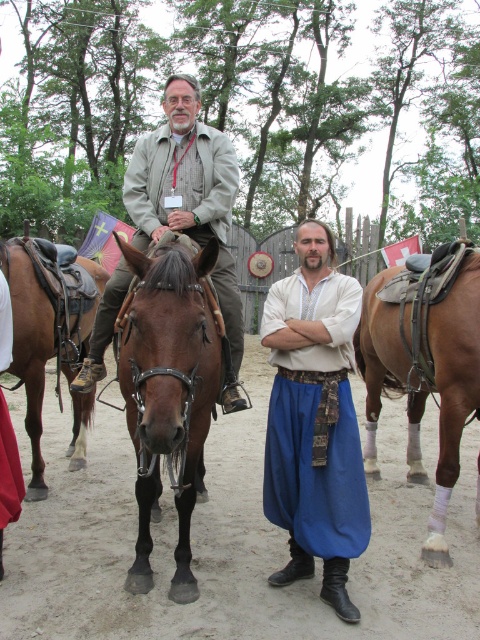
Looking at this image, is brown leather horse at center above brown leather saddle at left?

Indeed, brown leather horse at center is positioned over brown leather saddle at left.

Between brown leather horse at center and brown leather saddle at left, which one appears on the right side from the viewer's perspective?

brown leather horse at center is more to the right.

Where is `brown leather horse at center`? The width and height of the screenshot is (480, 640). brown leather horse at center is located at coordinates (315, 424).

Identify the location of brown leather horse at center. (315, 424).

Which is behind, point (232, 321) or point (32, 349)?

The point (32, 349) is behind.

Find the location of a particular element. The width and height of the screenshot is (480, 640). matte beige jacket at center is located at coordinates (190, 202).

Which is below, matte white shirt at center or brown leather saddle at right?

brown leather saddle at right is lower down.

You are a GUI agent. You are given a task and a screenshot of the screen. Output one action in this format:
    pyautogui.click(x=<x>, y=<y>)
    Task: Click on the matte white shirt at center
    Image resolution: width=480 pixels, height=640 pixels.
    Given the screenshot: What is the action you would take?
    pyautogui.click(x=314, y=420)

Does point (284, 316) come behind point (462, 296)?

No, it is not.

In order to click on matte white shirt at center in this screenshot , I will do `click(314, 420)`.